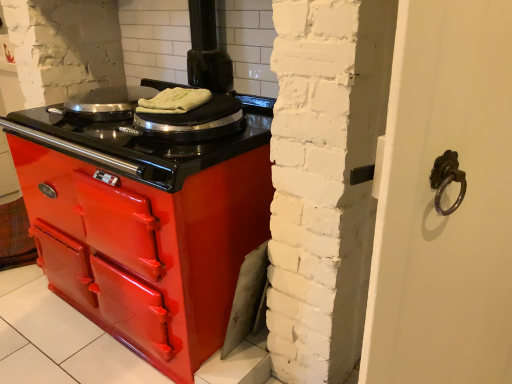
Question: Considering the positions of point (50, 109) and point (196, 105), is point (50, 109) closer or farther from the camera than point (196, 105)?

Choices:
 (A) farther
 (B) closer

Answer: (A)

Question: In terms of size, does shiny metallic pan at upper left appear bigger or smaller than white cloth at center?

Choices:
 (A) big
 (B) small

Answer: (A)

Question: In terms of height, does shiny metallic pan at upper left look taller or shorter compared to white cloth at center?

Choices:
 (A) short
 (B) tall

Answer: (B)

Question: From the image's perspective, is white cloth at center above or below shiny metallic pan at upper left?

Choices:
 (A) below
 (B) above

Answer: (A)

Question: In terms of height, does white cloth at center look taller or shorter compared to shiny metallic pan at upper left?

Choices:
 (A) tall
 (B) short

Answer: (B)

Question: In the image, is white cloth at center positioned in front of or behind shiny metallic pan at upper left?

Choices:
 (A) front
 (B) behind

Answer: (A)

Question: Do you think white cloth at center is within shiny metallic pan at upper left, or outside of it?

Choices:
 (A) inside
 (B) outside

Answer: (B)